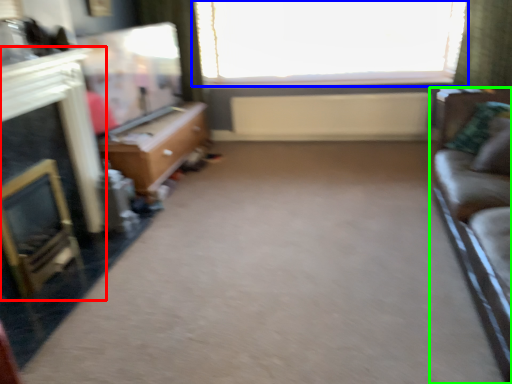
Question: Estimate the real-world distances between objects in this image. Which object is closer to fireplace (highlighted by a red box), window (highlighted by a blue box) or studio couch (highlighted by a green box)?

Choices:
 (A) window
 (B) studio couch

Answer: (B)